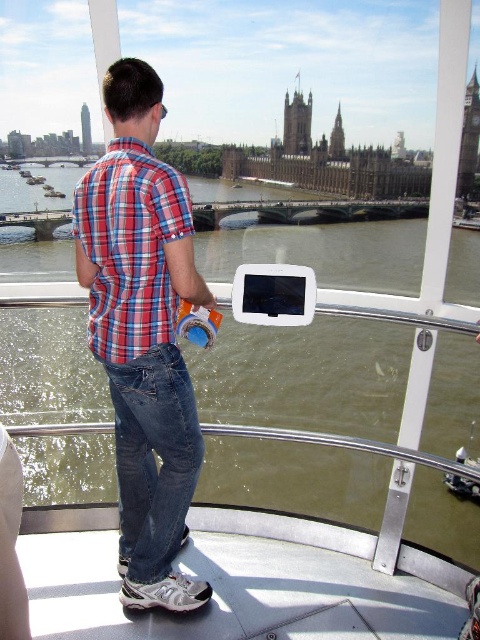
Looking at this image, does greenish water at center appear on the right side of plaid cotton shirt at center?

Indeed, greenish water at center is positioned on the right side of plaid cotton shirt at center.

Who is positioned more to the left, greenish water at center or plaid cotton shirt at center?

Positioned to the left is plaid cotton shirt at center.

The image size is (480, 640). What do you see at coordinates (305, 376) in the screenshot? I see `greenish water at center` at bounding box center [305, 376].

You are a GUI agent. You are given a task and a screenshot of the screen. Output one action in this format:
    pyautogui.click(x=<x>, y=<y>)
    Task: Click on the greenish water at center
    The image size is (480, 640).
    Given the screenshot: What is the action you would take?
    pyautogui.click(x=305, y=376)

Between greenish water at center and red plaid shirt at center, which one appears on the right side from the viewer's perspective?

greenish water at center

Between greenish water at center and red plaid shirt at center, which one appears on the left side from the viewer's perspective?

red plaid shirt at center is more to the left.

Image resolution: width=480 pixels, height=640 pixels. In order to click on greenish water at center in this screenshot , I will do `click(305, 376)`.

Between plaid cotton shirt at center and red plaid shirt at center, which one appears on the right side from the viewer's perspective?

plaid cotton shirt at center

Is plaid cotton shirt at center bigger than red plaid shirt at center?

Correct, plaid cotton shirt at center is larger in size than red plaid shirt at center.

What do you see at coordinates (143, 333) in the screenshot?
I see `plaid cotton shirt at center` at bounding box center [143, 333].

You are a GUI agent. You are given a task and a screenshot of the screen. Output one action in this format:
    pyautogui.click(x=<x>, y=<y>)
    Task: Click on the plaid cotton shirt at center
    This screenshot has height=640, width=480.
    Given the screenshot: What is the action you would take?
    pyautogui.click(x=143, y=333)